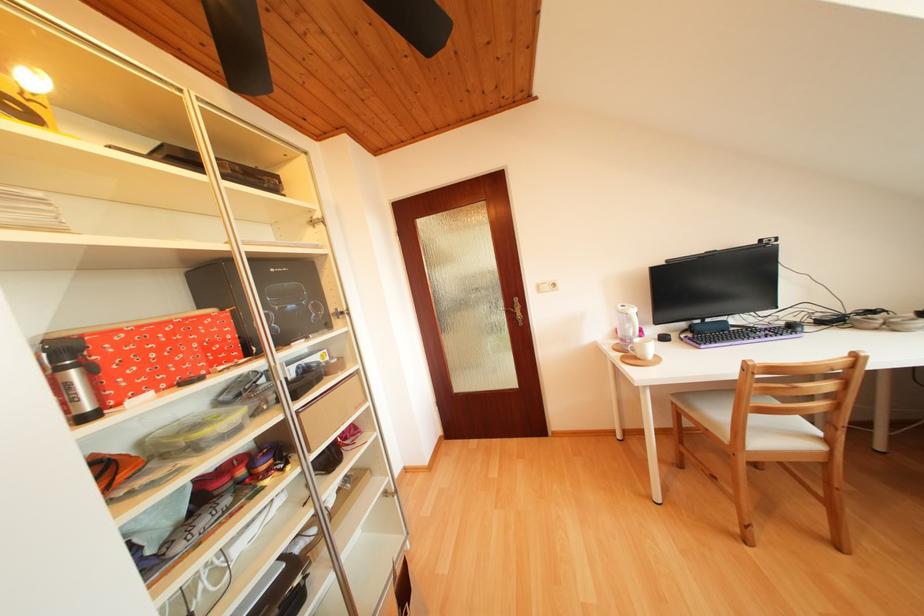
The image size is (924, 616). Describe the element at coordinates (517, 310) in the screenshot. I see `the door keyhole` at that location.